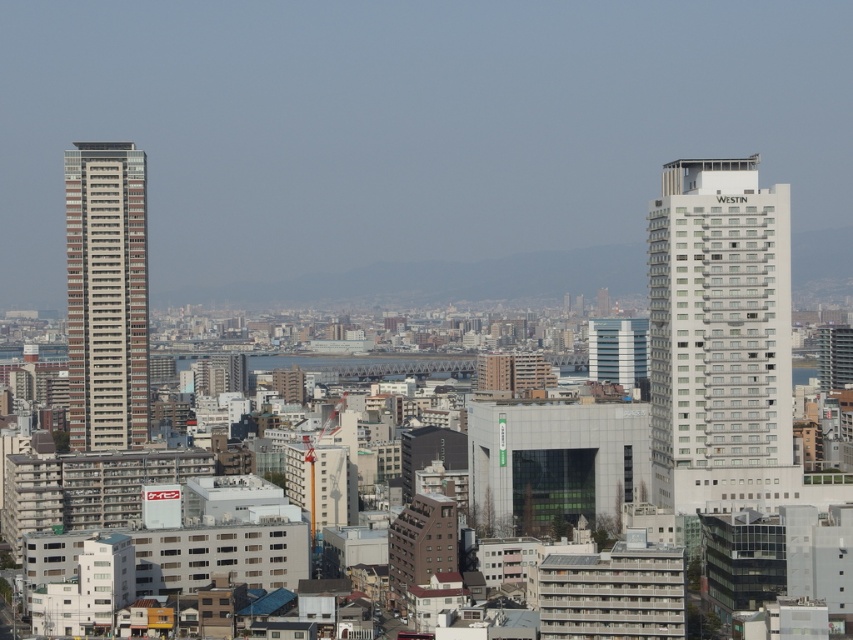
Who is positioned more to the right, white glossy hotel at right or brown textured building at left?

Positioned to the right is white glossy hotel at right.

Who is more forward, (676,369) or (112,352)?

Positioned in front is point (676,369).

Does point (697, 259) come in front of point (131, 268)?

Yes, point (697, 259) is closer to viewer.

The height and width of the screenshot is (640, 853). In order to click on white glossy hotel at right in this screenshot , I will do `click(720, 339)`.